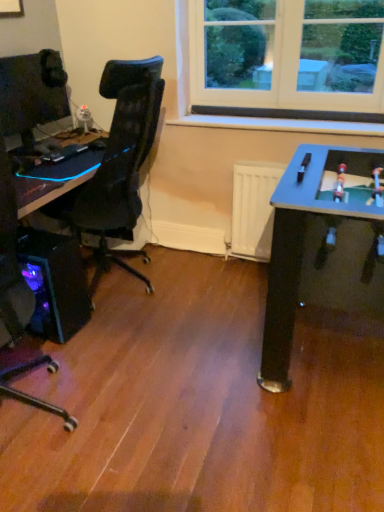
Question: Considering the relative positions of black plastic desk at left and translucent purple plastic computer tower at lower left in the image provided, is black plastic desk at left to the right of translucent purple plastic computer tower at lower left from the viewer's perspective?

Choices:
 (A) no
 (B) yes

Answer: (B)

Question: From the image's perspective, is black plastic desk at left over translucent purple plastic computer tower at lower left?

Choices:
 (A) no
 (B) yes

Answer: (B)

Question: Does black plastic desk at left contain translucent purple plastic computer tower at lower left?

Choices:
 (A) no
 (B) yes

Answer: (A)

Question: Would you say black plastic desk at left is a long distance from translucent purple plastic computer tower at lower left?

Choices:
 (A) no
 (B) yes

Answer: (A)

Question: Does black plastic desk at left have a lesser width compared to translucent purple plastic computer tower at lower left?

Choices:
 (A) no
 (B) yes

Answer: (A)

Question: Considering the relative sizes of black plastic desk at left and translucent purple plastic computer tower at lower left in the image provided, is black plastic desk at left shorter than translucent purple plastic computer tower at lower left?

Choices:
 (A) no
 (B) yes

Answer: (B)

Question: From the image's perspective, is matte black monitor at left beneath translucent purple plastic computer tower at lower left?

Choices:
 (A) yes
 (B) no

Answer: (B)

Question: Is matte black monitor at left turned away from translucent purple plastic computer tower at lower left?

Choices:
 (A) yes
 (B) no

Answer: (B)

Question: Is the surface of matte black monitor at left in direct contact with translucent purple plastic computer tower at lower left?

Choices:
 (A) yes
 (B) no

Answer: (B)

Question: From a real-world perspective, is matte black monitor at left below translucent purple plastic computer tower at lower left?

Choices:
 (A) yes
 (B) no

Answer: (B)

Question: Is the depth of matte black monitor at left less than that of translucent purple plastic computer tower at lower left?

Choices:
 (A) no
 (B) yes

Answer: (A)

Question: Is there a large distance between matte black monitor at left and translucent purple plastic computer tower at lower left?

Choices:
 (A) yes
 (B) no

Answer: (B)

Question: Is matte black monitor at left bigger than black plastic desk at left?

Choices:
 (A) yes
 (B) no

Answer: (B)